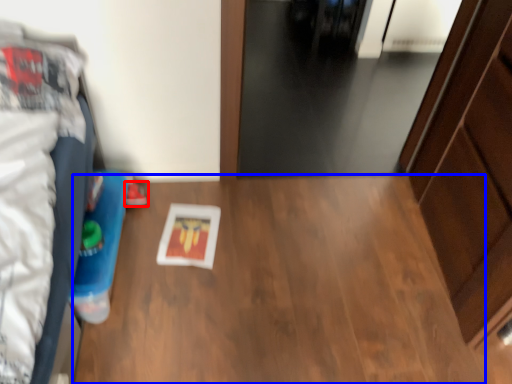
Question: Which object is closer to the camera taking this photo, footwear (highlighted by a red box) or table (highlighted by a blue box)?

Choices:
 (A) footwear
 (B) table

Answer: (B)